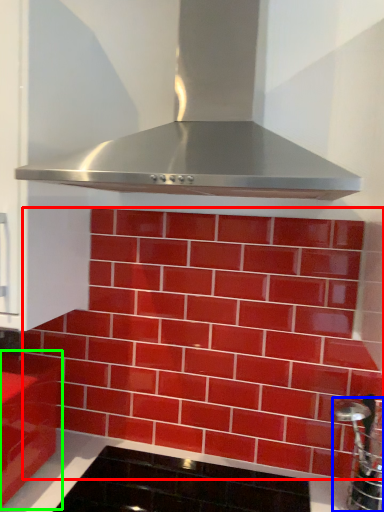
Question: Based on their relative distances, which object is farther from brickwork (highlighted by a red box)? Choose from stainless steel (highlighted by a blue box) and cabinetry (highlighted by a green box).

Choices:
 (A) stainless steel
 (B) cabinetry

Answer: (B)